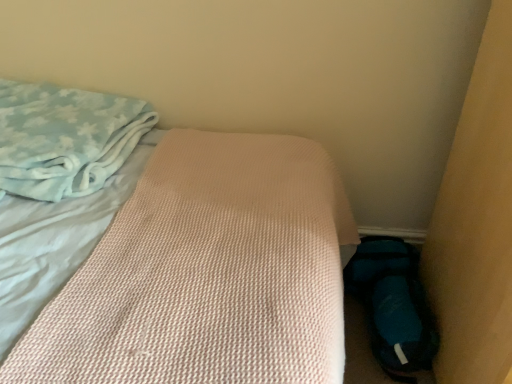
Question: Is light blue plush blanket at upper left smaller than pink textured mattress at center?

Choices:
 (A) yes
 (B) no

Answer: (A)

Question: Does light blue plush blanket at upper left come in front of pink textured mattress at center?

Choices:
 (A) yes
 (B) no

Answer: (B)

Question: Is light blue plush blanket at upper left facing towards pink textured mattress at center?

Choices:
 (A) yes
 (B) no

Answer: (A)

Question: Is light blue plush blanket at upper left to the right of pink textured mattress at center from the viewer's perspective?

Choices:
 (A) yes
 (B) no

Answer: (B)

Question: From a real-world perspective, is light blue plush blanket at upper left over pink textured mattress at center?

Choices:
 (A) yes
 (B) no

Answer: (A)

Question: Is blue fabric shoe at lower right bigger or smaller than light blue plush blanket at upper left?

Choices:
 (A) small
 (B) big

Answer: (A)

Question: From the image's perspective, is blue fabric shoe at lower right above or below light blue plush blanket at upper left?

Choices:
 (A) below
 (B) above

Answer: (A)

Question: Visually, is blue fabric shoe at lower right positioned to the left or to the right of light blue plush blanket at upper left?

Choices:
 (A) left
 (B) right

Answer: (B)

Question: From a real-world perspective, relative to light blue plush blanket at upper left, is blue fabric shoe at lower right vertically above or below?

Choices:
 (A) above
 (B) below

Answer: (B)

Question: Choose the correct answer: Is pink textured mattress at center inside light blue plush blanket at upper left or outside it?

Choices:
 (A) outside
 (B) inside

Answer: (A)

Question: From the image's perspective, relative to light blue plush blanket at upper left, is pink textured mattress at center above or below?

Choices:
 (A) below
 (B) above

Answer: (A)

Question: In terms of width, does pink textured mattress at center look wider or thinner when compared to light blue plush blanket at upper left?

Choices:
 (A) thin
 (B) wide

Answer: (B)

Question: Is pink textured mattress at center bigger or smaller than light blue plush blanket at upper left?

Choices:
 (A) big
 (B) small

Answer: (A)

Question: Is pink textured mattress at center in front of or behind blue fabric shoe at lower right in the image?

Choices:
 (A) behind
 (B) front

Answer: (B)

Question: Is pink textured mattress at center taller or shorter than blue fabric shoe at lower right?

Choices:
 (A) tall
 (B) short

Answer: (A)